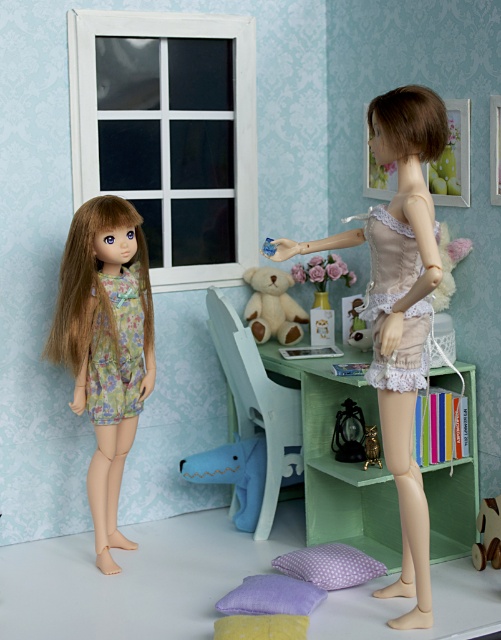
Is point (241, 588) closer to camera compared to point (482, 520)?

Yes, point (241, 588) is in front of point (482, 520).

Is point (303, 612) closer to camera compared to point (497, 541)?

Yes.

Image resolution: width=501 pixels, height=640 pixels. Find the location of `purple fabric pillow at lower center`. purple fabric pillow at lower center is located at coordinates (271, 596).

Is point (109, 396) farther from camera compared to point (276, 323)?

No, it is not.

Is matte floral dress at left positioned at the back of soft beige plush at center?

No, it is not.

The width and height of the screenshot is (501, 640). I want to click on matte floral dress at left, so click(x=106, y=346).

Which of these two, matte beige lace dress at center or lavender dotted pillow at lower center, stands taller?

With more height is matte beige lace dress at center.

Can you confirm if matte beige lace dress at center is positioned to the left of lavender dotted pillow at lower center?

Incorrect, matte beige lace dress at center is not on the left side of lavender dotted pillow at lower center.

The height and width of the screenshot is (640, 501). I want to click on matte beige lace dress at center, so click(399, 310).